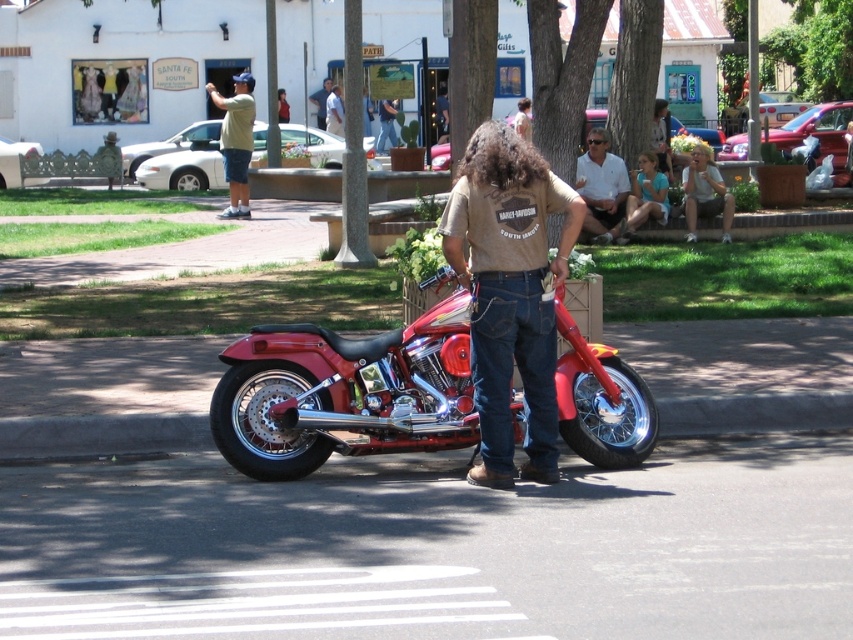
You are a photographer trying to capture both the shiny red motorcycle at center and the brushed metal shirt at center in a single frame. Given their sizes, which object should you focus on to ensure both fit clearly in the photo?

Since the shiny red motorcycle at center is larger than the brushed metal shirt at center, you should focus on the motorcycle to ensure both objects fit clearly in the photo.